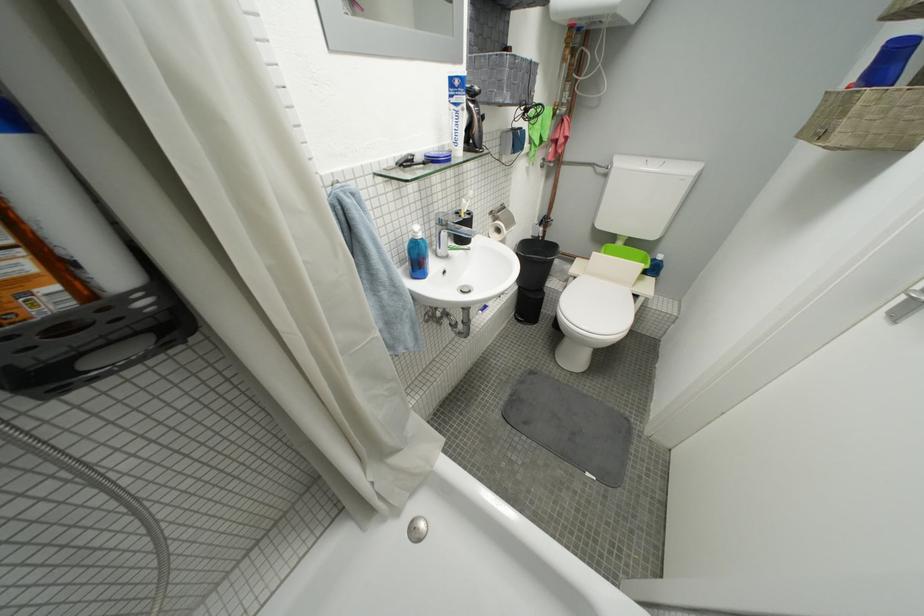
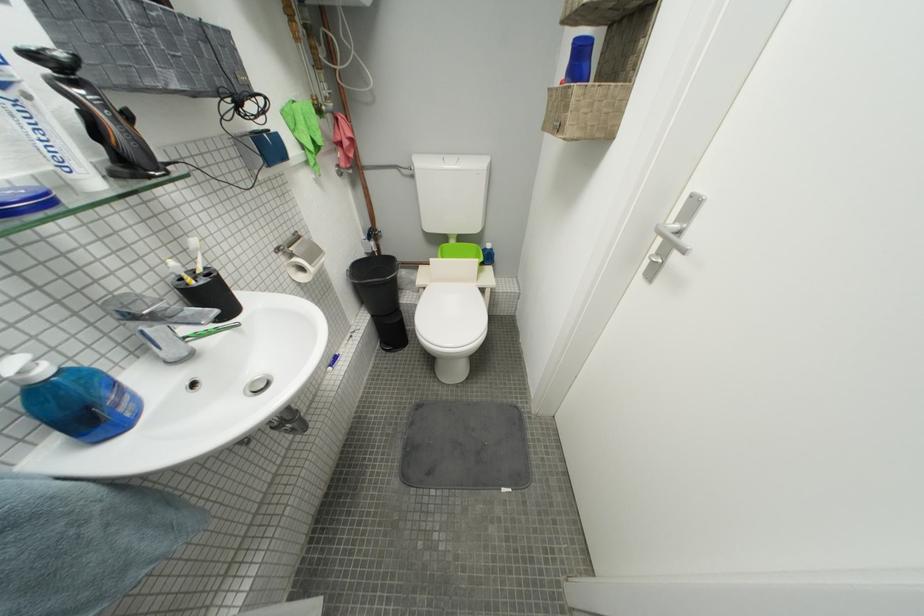
In the second image, find the point that corresponds to (468,155) in the first image.

(103, 185)